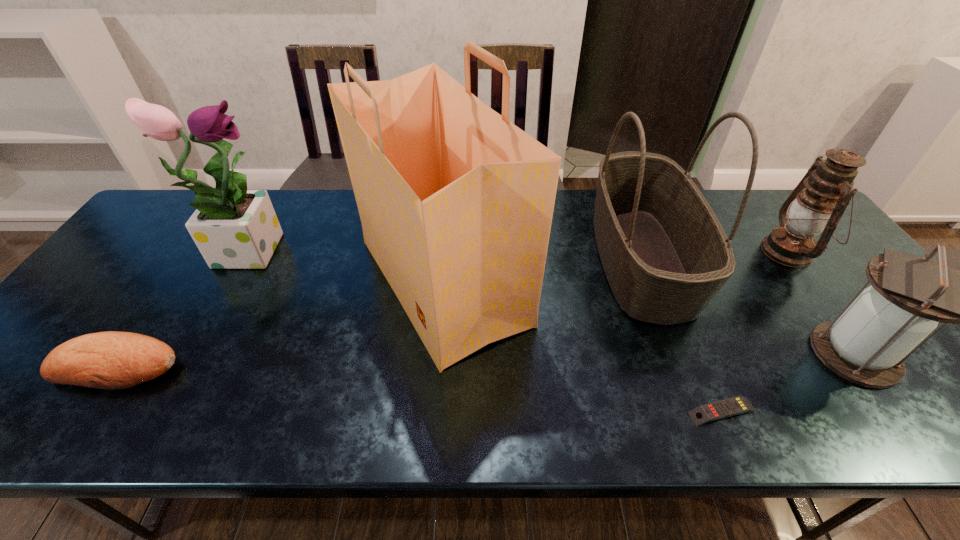
Identify the location of the third object from left to right. (456, 202).

The width and height of the screenshot is (960, 540). I want to click on the tallest object, so click(456, 202).

Locate an element on the screen. The height and width of the screenshot is (540, 960). flower arrangement is located at coordinates (234, 228).

What are the coordinates of `basket` in the screenshot? It's located at (665, 255).

Identify the location of lantern. The height and width of the screenshot is (540, 960). (818, 202).

Where is `lantern`? lantern is located at coordinates (867, 344).

Where is `bread`? This screenshot has height=540, width=960. bread is located at coordinates (113, 360).

In order to click on the shortest object in this screenshot , I will do `click(729, 407)`.

The width and height of the screenshot is (960, 540). Find the location of `remote control`. remote control is located at coordinates (729, 407).

Locate an element on the screen. The height and width of the screenshot is (540, 960). vacant space positioned 0.210m on the side of the grocery bag with the superhero design is located at coordinates (611, 282).